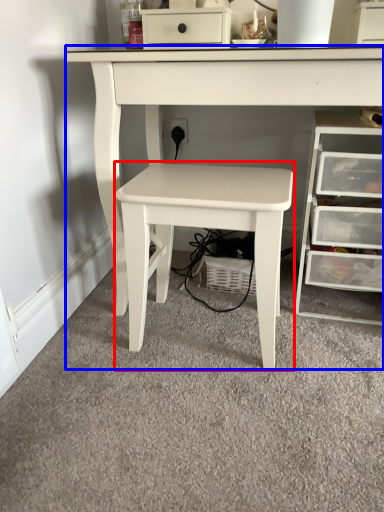
Question: Which object appears farthest to the camera in this image, table (highlighted by a red box) or table (highlighted by a blue box)?

Choices:
 (A) table
 (B) table

Answer: (A)